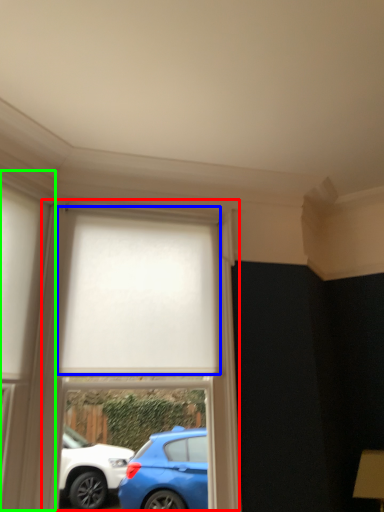
Question: Estimate the real-world distances between objects in this image. Which object is farther from bay window (highlighted by a red box), curtain (highlighted by a blue box) or glass door (highlighted by a green box)?

Choices:
 (A) curtain
 (B) glass door

Answer: (B)